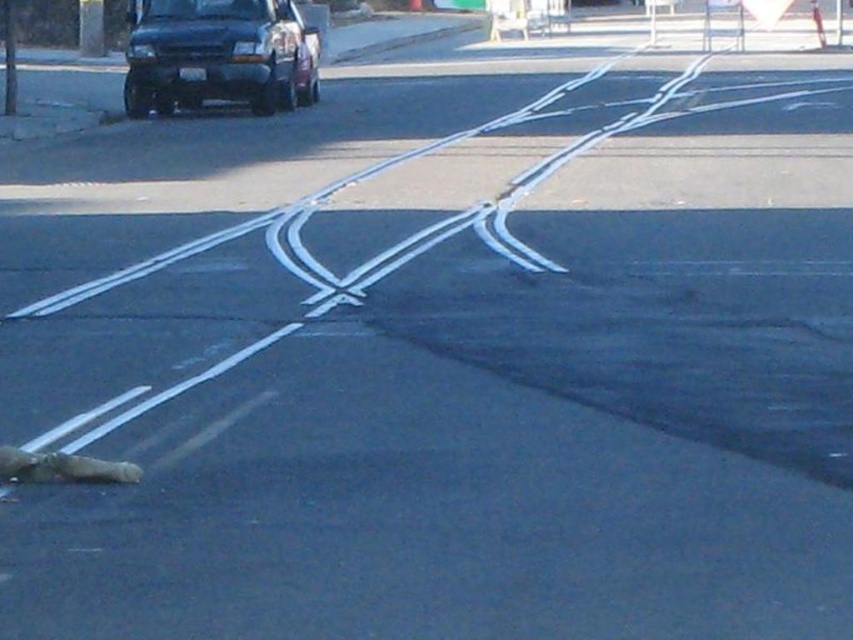
Question: Can you confirm if black matte van at upper left is wider than brown fur animal at lower left?

Choices:
 (A) yes
 (B) no

Answer: (A)

Question: Can you confirm if black matte van at upper left is bigger than brown fur animal at lower left?

Choices:
 (A) no
 (B) yes

Answer: (B)

Question: Which point is closer to the camera?

Choices:
 (A) black matte van at upper left
 (B) brown fur animal at lower left

Answer: (B)

Question: Does black matte van at upper left have a larger size compared to brown fur animal at lower left?

Choices:
 (A) no
 (B) yes

Answer: (B)